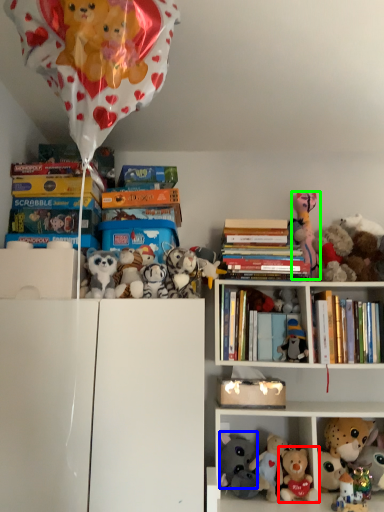
Question: Which is farther away from toy (highlighted by a red box)? toy (highlighted by a blue box) or toy (highlighted by a green box)?

Choices:
 (A) toy
 (B) toy

Answer: (B)